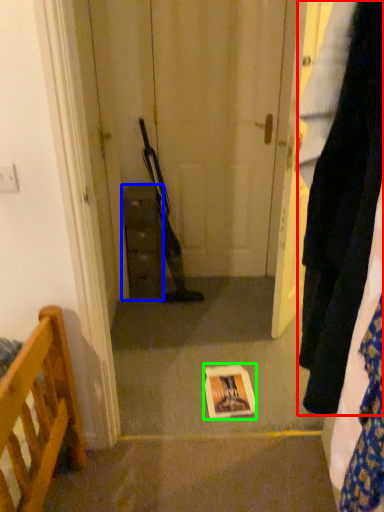
Question: Which is nearer to the clothing (highlighted by a red box)? cabinetry (highlighted by a blue box) or copy (highlighted by a green box).

Choices:
 (A) cabinetry
 (B) copy

Answer: (B)